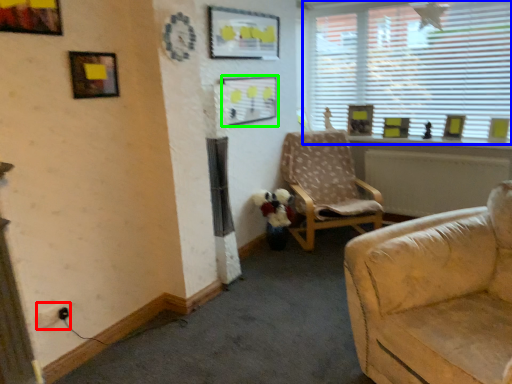
Question: Which object is the farthest from electric outlet (highlighted by a red box)? Choose among these: window (highlighted by a blue box) or picture frame (highlighted by a green box).

Choices:
 (A) window
 (B) picture frame

Answer: (A)